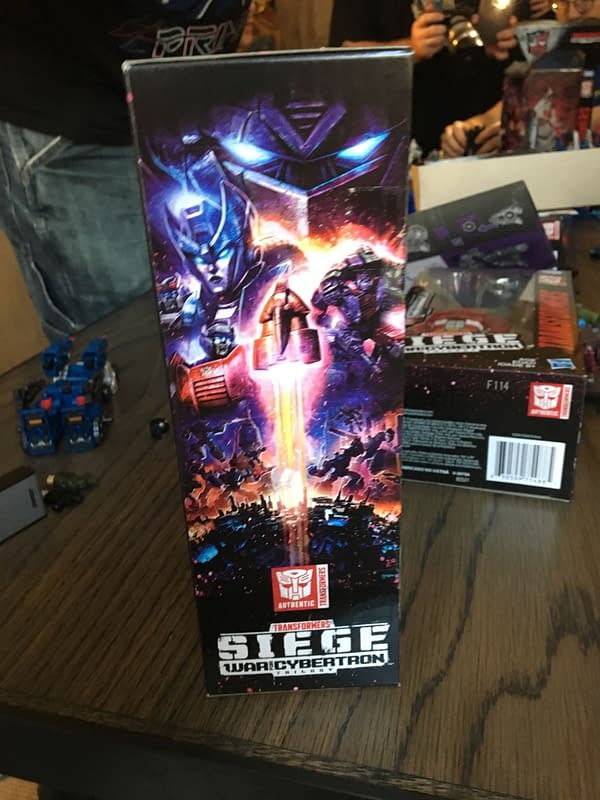
You are a GUI agent. You are given a task and a screenshot of the screen. Output one action in this format:
    pyautogui.click(x=<x>, y=<y>)
    Task: Click on the box
    This screenshot has height=800, width=600.
    Given the screenshot: What is the action you would take?
    click(x=458, y=397)